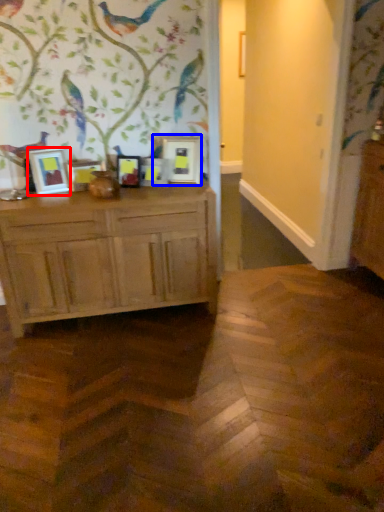
Question: Which point is further to the camera, picture frame (highlighted by a red box) or picture frame (highlighted by a blue box)?

Choices:
 (A) picture frame
 (B) picture frame

Answer: (B)